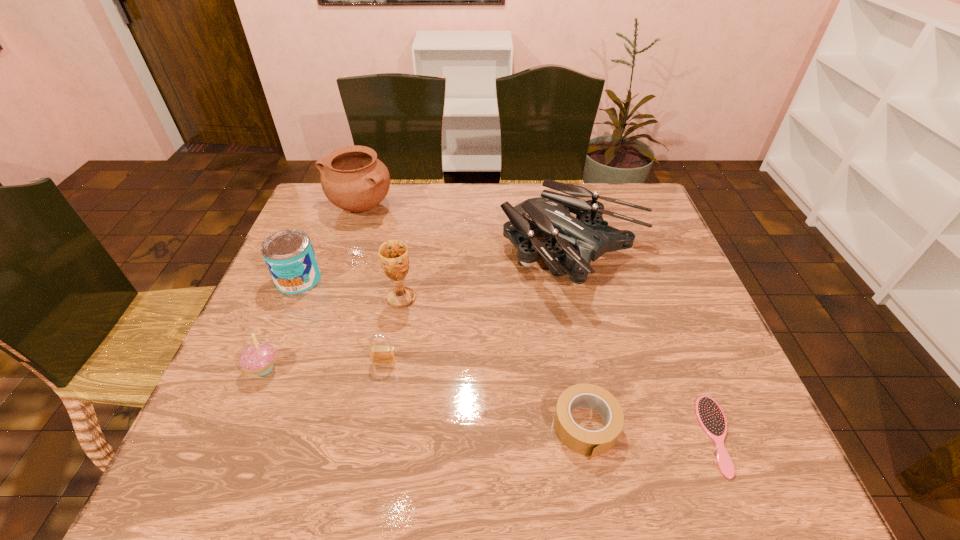
Where is `pottery`? pottery is located at coordinates pyautogui.click(x=352, y=178).

I want to click on chalice, so click(x=393, y=254).

At what (x,y) coordinates should I click in order to perform the action: click on drone. Please return your answer as a coordinate pair (x, y). Looking at the image, I should click on (572, 243).

Find the location of a particular element. The width and height of the screenshot is (960, 540). can is located at coordinates (289, 255).

What are the coordinates of `cupcake` in the screenshot? It's located at (259, 358).

The width and height of the screenshot is (960, 540). In order to click on padlock in this screenshot , I will do `click(379, 354)`.

This screenshot has width=960, height=540. I want to click on duct tape, so click(x=591, y=443).

Image resolution: width=960 pixels, height=540 pixels. What are the coordinates of `hairbrush` in the screenshot? It's located at (711, 418).

In order to click on free space located 0.180m on the right of the pottery in this screenshot , I will do `click(448, 206)`.

I want to click on vacant position located 0.110m on the back of the chalice, so click(408, 260).